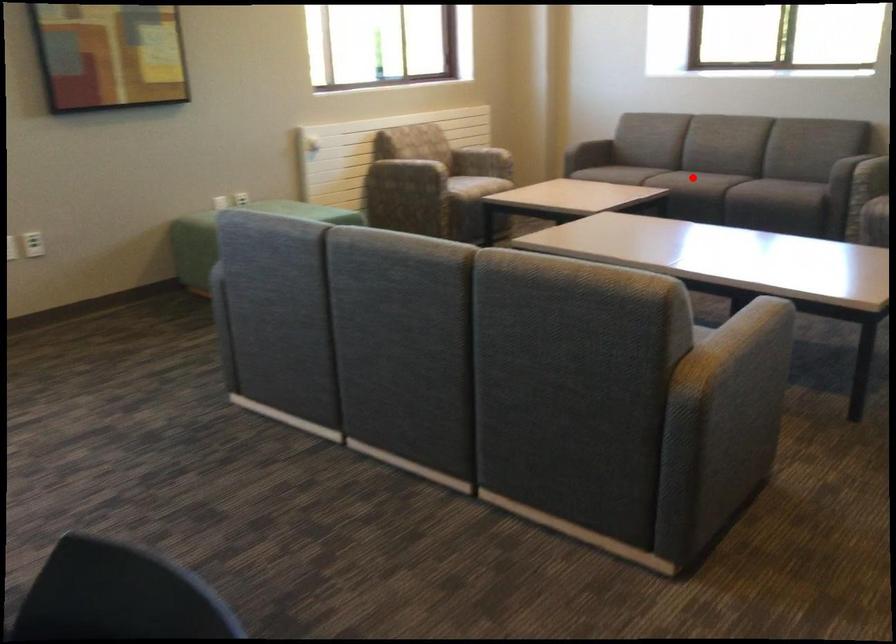
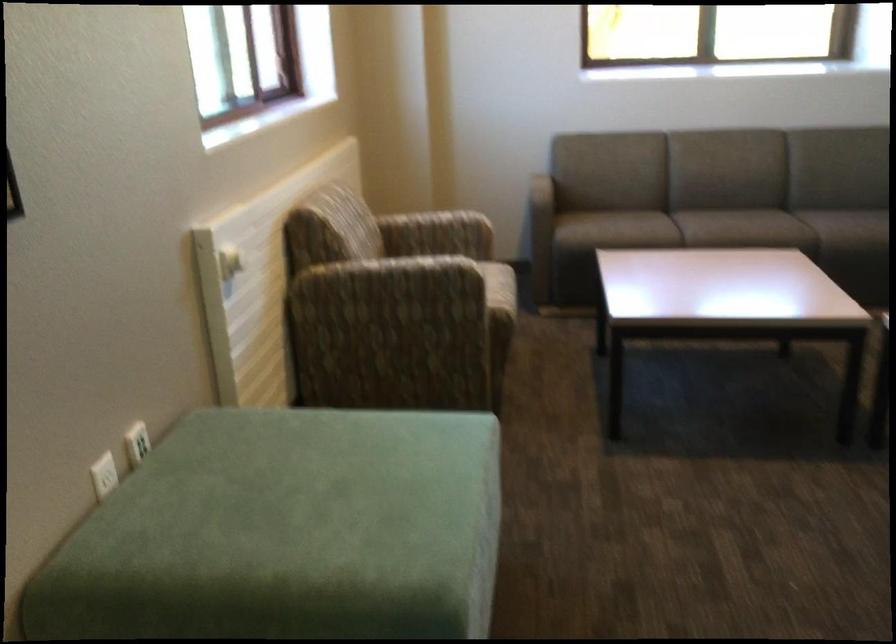
Question: I am providing you with two images of the same scene from different viewpoints. Image1 has a red point marked. In image2, the corresponding 3D location appears at what relative position? Reply with the corresponding letter.

Choices:
 (A) Closer
 (B) Farther

Answer: (A)